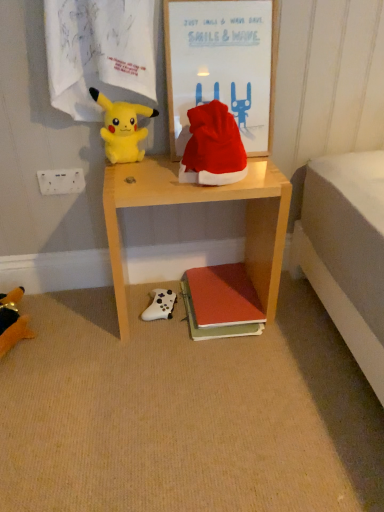
Identify the location of free space that is to the left of red velvet santa hat at center. Image resolution: width=384 pixels, height=512 pixels. (154, 174).